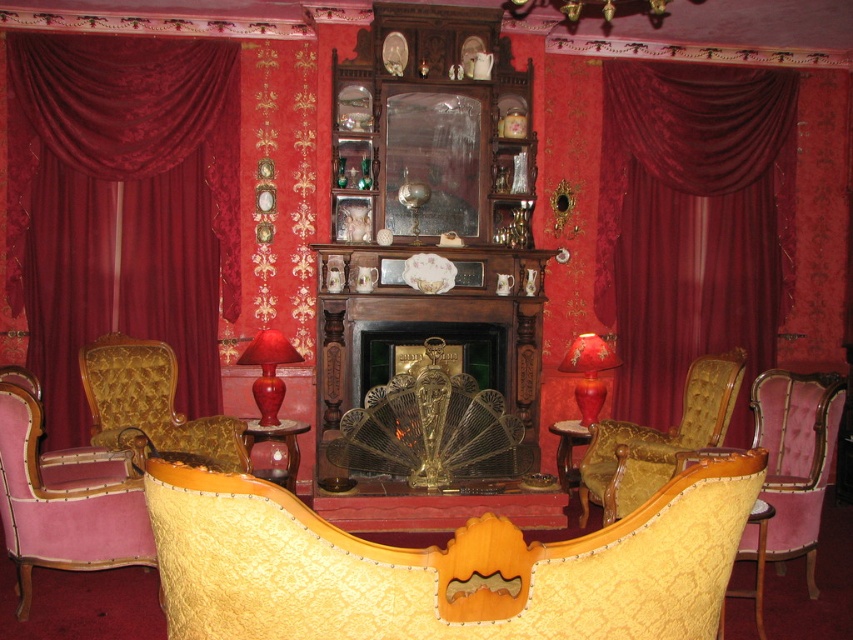
Question: Does velvet drapery at left have a lesser width compared to gold textured sofa at center?

Choices:
 (A) no
 (B) yes

Answer: (A)

Question: Which point is farther to the camera?

Choices:
 (A) yellow damask couch at center
 (B) shiny red glass lamp at center
 (C) gold-patterned armchair at center

Answer: (B)

Question: Is yellow damask couch at center below velvet drapery at left?

Choices:
 (A) no
 (B) yes

Answer: (B)

Question: Which point appears closest to the camera in this image?

Choices:
 (A) (566, 435)
 (B) (250, 420)

Answer: (B)

Question: Is gold textured armchair at left positioned before gold textured sofa at center?

Choices:
 (A) no
 (B) yes

Answer: (B)

Question: Among these objects, which one is farthest from the camera?

Choices:
 (A) gold textured armchair at left
 (B) shiny red glass lamp at center

Answer: (B)